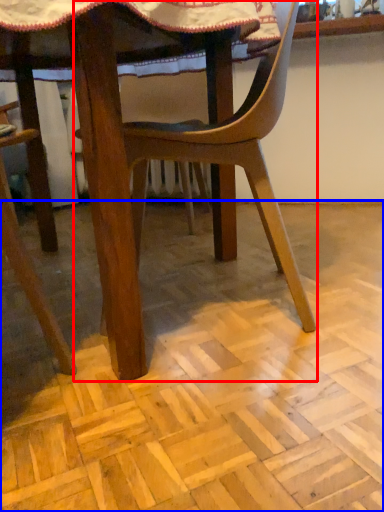
Question: Which object appears farthest to the camera in this image, chair (highlighted by a red box) or plywood (highlighted by a blue box)?

Choices:
 (A) chair
 (B) plywood

Answer: (A)